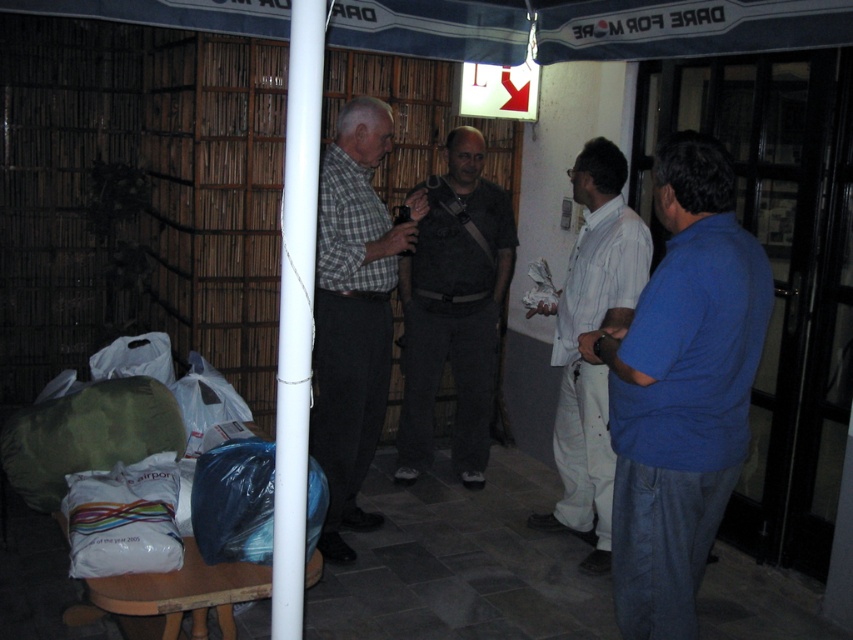
Question: Can you confirm if blue cotton shirt at right is positioned above checkered fabric shirt at center?

Choices:
 (A) no
 (B) yes

Answer: (A)

Question: Among these objects, which one is farthest from the camera?

Choices:
 (A) checkered fabric shirt at center
 (B) blue cotton shirt at right
 (C) white plastic pole at center

Answer: (A)

Question: Considering the relative positions of checkered fabric shirt at center and white plastic pole at center in the image provided, where is checkered fabric shirt at center located with respect to white plastic pole at center?

Choices:
 (A) above
 (B) below

Answer: (A)

Question: Based on their relative distances, which object is nearer to the white cotton shirt at center?

Choices:
 (A) blue cotton shirt at right
 (B) checkered fabric shirt at center
 (C) dark gray fabric shirt at center
 (D) white plastic pole at center

Answer: (C)

Question: Which object is closer to the camera taking this photo?

Choices:
 (A) white plastic pole at center
 (B) checkered fabric shirt at center
 (C) dark gray fabric shirt at center

Answer: (A)

Question: Is blue cotton shirt at right to the left of dark gray fabric shirt at center from the viewer's perspective?

Choices:
 (A) no
 (B) yes

Answer: (A)